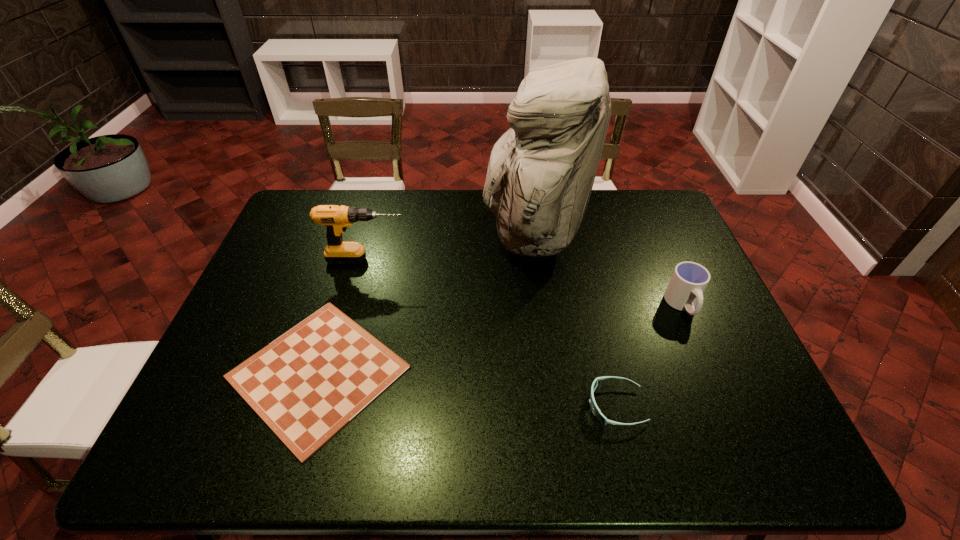
In order to click on unoccupied position between the goggles and the tallest object in this screenshot , I will do `click(574, 320)`.

This screenshot has height=540, width=960. I want to click on vacant area that lies between the fourth shortest object and the second shortest object, so click(x=492, y=333).

Where is `vacant point located between the checkerboard and the second shortest object`? The width and height of the screenshot is (960, 540). vacant point located between the checkerboard and the second shortest object is located at coordinates tap(468, 389).

Where is `vacant region between the drill and the goggles`? This screenshot has height=540, width=960. vacant region between the drill and the goggles is located at coordinates (492, 333).

Identify the location of empty location between the second tallest object and the goggles. (492, 333).

Locate an element on the screen. unoccupied area between the backpack and the checkerboard is located at coordinates (425, 303).

Where is `unoccupied area between the tallest object and the goggles`? unoccupied area between the tallest object and the goggles is located at coordinates (574, 320).

Identify the location of the fourth closest object relative to the shortest object. (689, 280).

Identify which object is the fourth closest to the second shortest object. Please provide its 2D coordinates. Your answer should be formatted as a tuple, i.e. [(x, y)], where the tuple contains the x and y coordinates of a point satisfying the conditions above.

[(336, 218)]

Where is `free space that satisfies the following two spatial constraints: 1. with the handle on the side of the cup; 2. on the front-facing side of the second shortest object`? free space that satisfies the following two spatial constraints: 1. with the handle on the side of the cup; 2. on the front-facing side of the second shortest object is located at coordinates (726, 406).